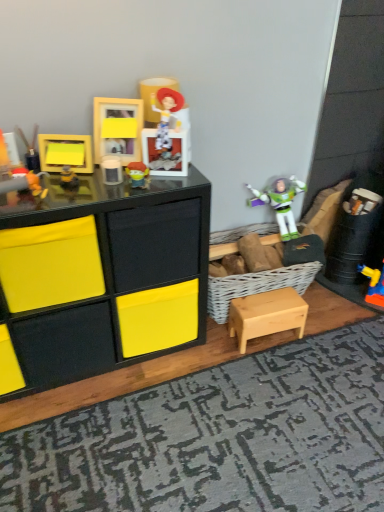
What are the coordinates of `vacant area situated to the left side of light wood table at lower right` in the screenshot? It's located at (219, 348).